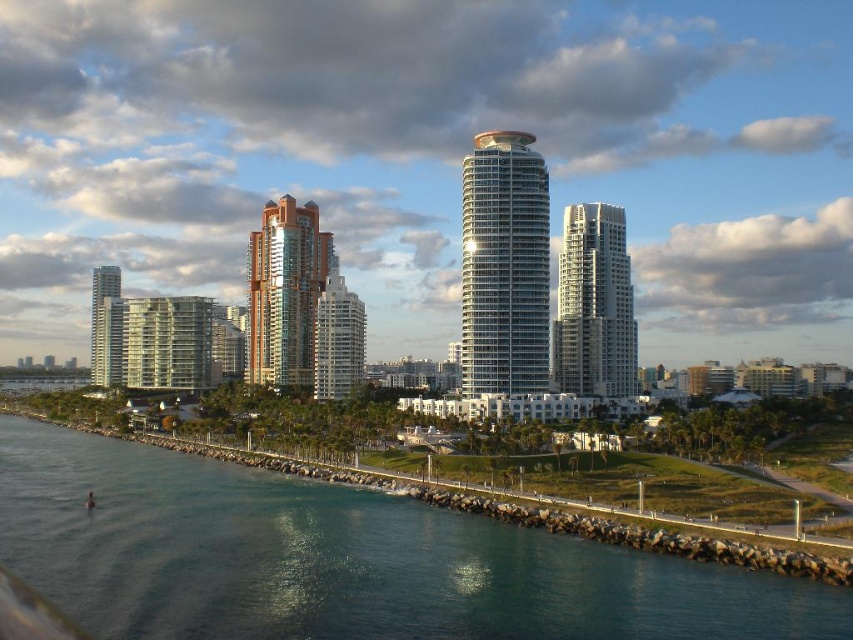
Question: Which point is closer to the camera?

Choices:
 (A) (556, 365)
 (B) (322, 262)
 (C) (572, 628)
 (D) (113, 280)

Answer: (C)

Question: Is clear blue water at lower left wider than glassy steel tower at center?

Choices:
 (A) no
 (B) yes

Answer: (B)

Question: Does glassy steel tower at center appear under glassy reflective building at center?

Choices:
 (A) yes
 (B) no

Answer: (B)

Question: Which point is farther from the camera taking this photo?

Choices:
 (A) coord(312,348)
 (B) coord(479,138)
 (C) coord(94,312)

Answer: (C)

Question: Among these points, which one is nearest to the camera?

Choices:
 (A) (611, 314)
 (B) (471, 387)
 (C) (322, 339)

Answer: (B)

Question: Does clear blue water at lower left have a lesser width compared to glassy steel tower at center?

Choices:
 (A) yes
 (B) no

Answer: (B)